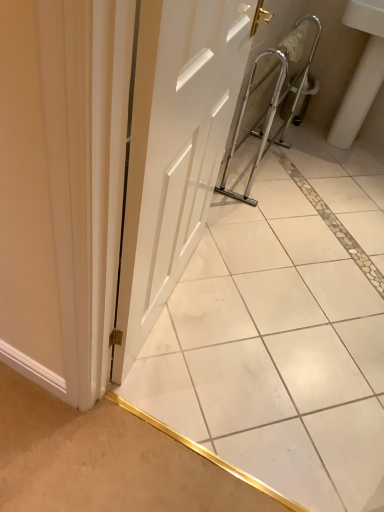
Question: Can you confirm if white ceramic sink at right is positioned to the right of white matte door at center?

Choices:
 (A) no
 (B) yes

Answer: (B)

Question: Is white ceramic sink at right not near white matte door at center?

Choices:
 (A) no
 (B) yes

Answer: (B)

Question: Is white ceramic sink at right turned away from white matte door at center?

Choices:
 (A) yes
 (B) no

Answer: (B)

Question: Is white ceramic sink at right taller than white matte door at center?

Choices:
 (A) yes
 (B) no

Answer: (A)

Question: Is white ceramic sink at right at the left side of white matte door at center?

Choices:
 (A) no
 (B) yes

Answer: (A)

Question: Considering the relative sizes of white ceramic sink at right and white matte door at center in the image provided, is white ceramic sink at right shorter than white matte door at center?

Choices:
 (A) no
 (B) yes

Answer: (A)

Question: From the image's perspective, does white glossy tile at center appear lower than white ceramic sink at right?

Choices:
 (A) yes
 (B) no

Answer: (A)

Question: Could you tell me if white glossy tile at center is facing white ceramic sink at right?

Choices:
 (A) no
 (B) yes

Answer: (B)

Question: Is white glossy tile at center far away from white ceramic sink at right?

Choices:
 (A) no
 (B) yes

Answer: (B)

Question: Is white glossy tile at center with white ceramic sink at right?

Choices:
 (A) yes
 (B) no

Answer: (B)

Question: Does white glossy tile at center contain white ceramic sink at right?

Choices:
 (A) no
 (B) yes

Answer: (A)

Question: Considering the relative positions of white glossy tile at center and white ceramic sink at right in the image provided, is white glossy tile at center to the left of white ceramic sink at right from the viewer's perspective?

Choices:
 (A) no
 (B) yes

Answer: (B)

Question: Considering the relative sizes of white ceramic sink at right and white glossy tile at center in the image provided, is white ceramic sink at right wider than white glossy tile at center?

Choices:
 (A) yes
 (B) no

Answer: (A)